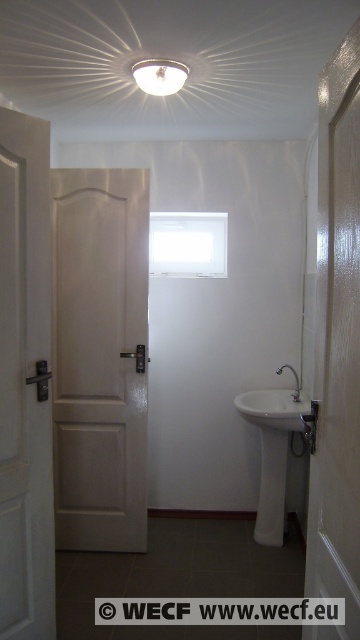
Question: Estimate the real-world distances between objects in this image. Which object is farther from the matte silver faucet at center right?

Choices:
 (A) white matte door at left
 (B) white glossy door at center
 (C) matte white light fixture at upper center

Answer: (A)

Question: Based on their relative distances, which object is farther from the white glossy pedestal sink at lower right?

Choices:
 (A) matte white light fixture at upper center
 (B) white glossy door at center
 (C) white matte door at left
 (D) matte silver faucet at center right

Answer: (A)

Question: Where is white matte door at left located in relation to white glossy pedestal sink at lower right in the image?

Choices:
 (A) right
 (B) left

Answer: (B)

Question: Is white glossy door at center thinner than white matte door at left?

Choices:
 (A) no
 (B) yes

Answer: (A)

Question: Among these points, which one is farthest from the camera?

Choices:
 (A) (275, 465)
 (B) (181, 65)

Answer: (A)

Question: Does matte white light fixture at upper center appear on the right side of matte silver faucet at center right?

Choices:
 (A) yes
 (B) no

Answer: (B)